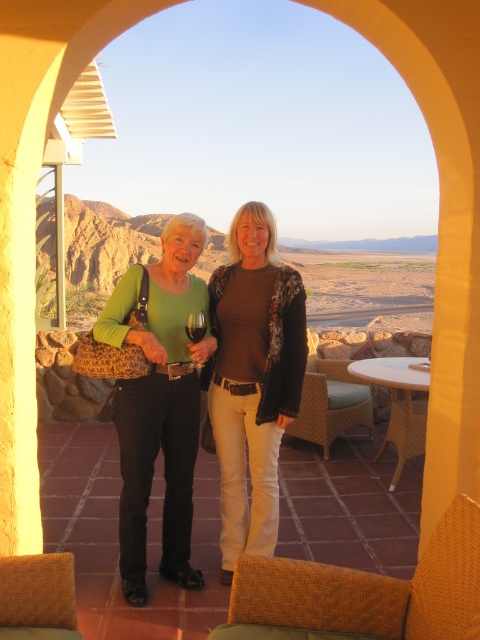
Can you confirm if brown matte sweater at center is thinner than translucent glass wine at center?

No, brown matte sweater at center is not thinner than translucent glass wine at center.

Is point (276, 492) farther from viewer compared to point (191, 333)?

Yes.

This screenshot has width=480, height=640. Find the location of `brown matte sweater at center`. brown matte sweater at center is located at coordinates [252, 378].

Is brown matte sweater at center closer to the viewer compared to transparent glass at center?

No.

Between brown matte sweater at center and transparent glass at center, which one has less height?

transparent glass at center is shorter.

Between point (300, 378) and point (205, 324), which one is positioned behind?

Positioned behind is point (205, 324).

Where is `brown matte sweater at center`? The height and width of the screenshot is (640, 480). brown matte sweater at center is located at coordinates (252, 378).

Between matte green sweater at center and brown matte sweater at center, which one is positioned higher?

brown matte sweater at center

In the scene shown: Between matte green sweater at center and brown matte sweater at center, which one has less height?

brown matte sweater at center is shorter.

Who is more distant from viewer, [218,444] or [266,474]?

Positioned behind is point [218,444].

Find the location of a particular element. matte green sweater at center is located at coordinates pos(252,378).